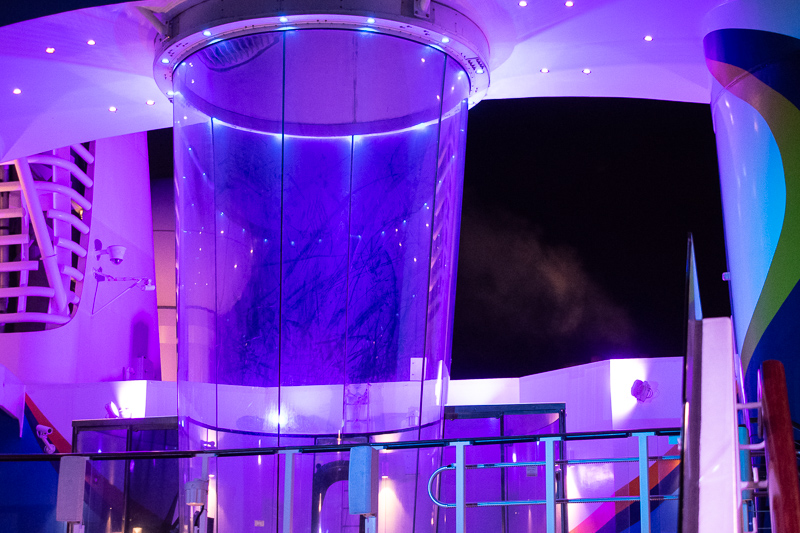
Where is `wall`? The width and height of the screenshot is (800, 533). wall is located at coordinates (608, 407), (494, 399), (146, 403), (126, 340).